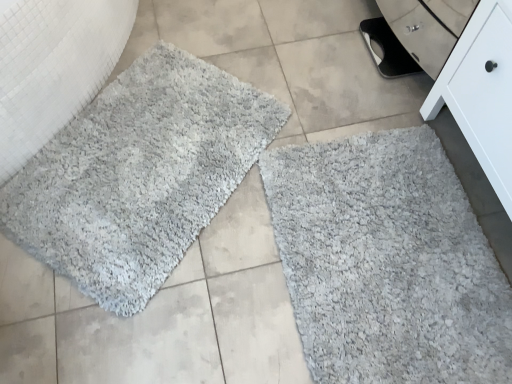
Question: Looking at their shapes, would you say white matte cabinet at lower right is wider or thinner than gray shaggy bath mat at lower right, marked as the second bath mat in a left-to-right arrangement?

Choices:
 (A) thin
 (B) wide

Answer: (A)

Question: In terms of height, does white matte cabinet at lower right look taller or shorter compared to gray shaggy bath mat at lower right, which appears as the first bath mat when viewed from the right?

Choices:
 (A) short
 (B) tall

Answer: (B)

Question: Considering the real-world distances, which object is farthest from the gray shaggy bath mat at lower right, which appears as the first bath mat when viewed from the right?

Choices:
 (A) white matte cabinet at lower right
 (B) gray shaggy rug at left
 (C) gray shaggy rug at upper left, acting as the 1th bath mat starting from the left

Answer: (B)

Question: Estimate the real-world distances between objects in this image. Which object is closer to the white matte cabinet at lower right?

Choices:
 (A) gray shaggy rug at upper left, which is the second bath mat in right-to-left order
 (B) gray shaggy bath mat at lower right, which appears as the first bath mat when viewed from the right
 (C) gray shaggy rug at left

Answer: (B)